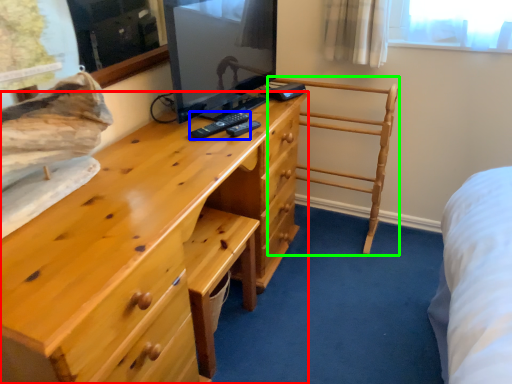
Question: Based on their relative distances, which object is farther from chest of drawers (highlighted by a red box)? Choose from remote (highlighted by a blue box) and furniture (highlighted by a green box).

Choices:
 (A) remote
 (B) furniture

Answer: (B)